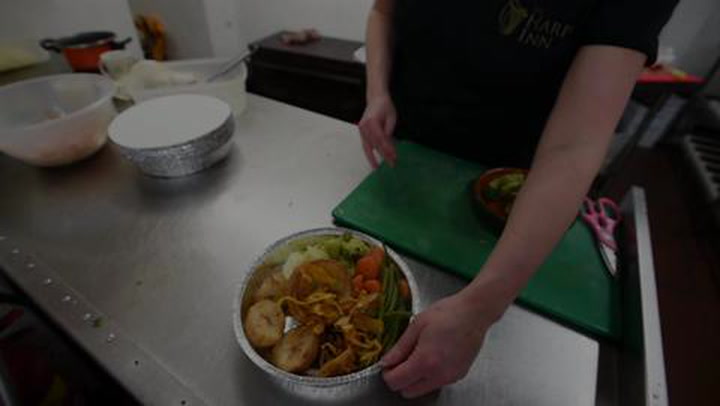
Find the location of a particular element. white wall in kitchen is located at coordinates (220, 24), (54, 19).